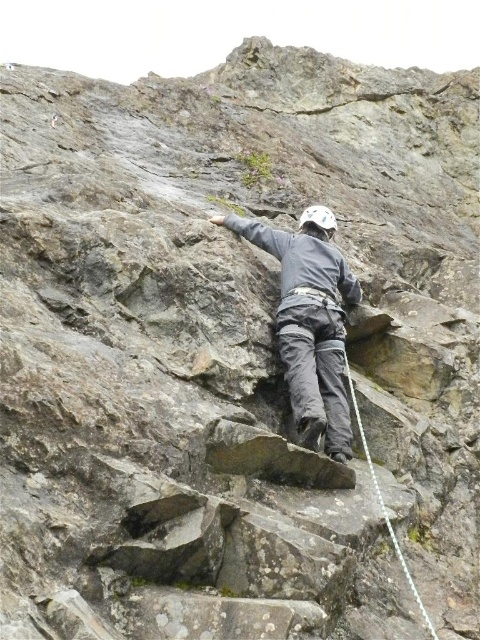
Is point (295, 358) positioned behind point (359, 420)?

That is False.

Locate an element on the screen. The image size is (480, 640). gray fabric climbing suit at center is located at coordinates (310, 323).

Where is `gray fabric climbing suit at center`? Image resolution: width=480 pixels, height=640 pixels. gray fabric climbing suit at center is located at coordinates (310, 323).